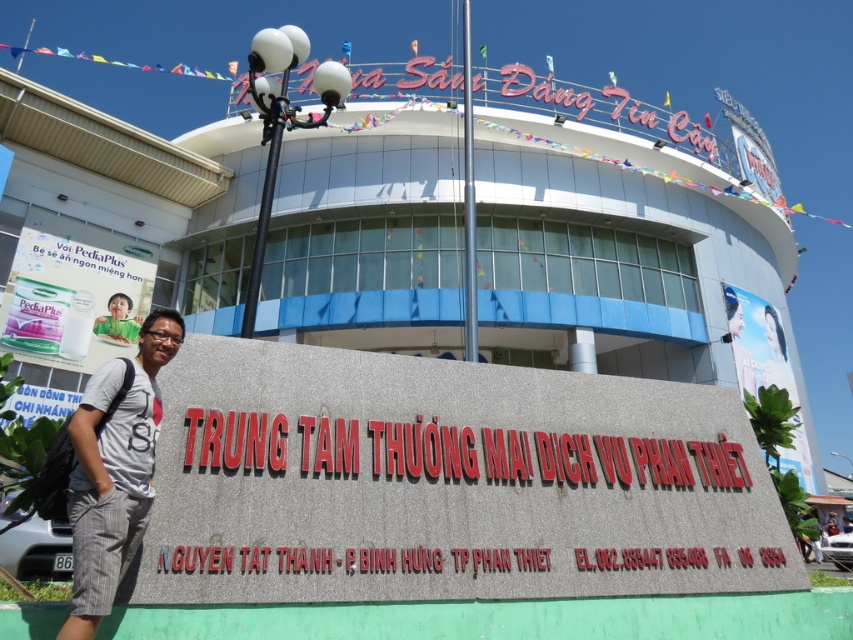
Measure the distance between gray cotton t-shirt at left and white plastic sign at upper left.

They are 14.67 meters apart.

Is point (126, 477) positioned behind point (41, 253)?

No, (126, 477) is in front of (41, 253).

Between point (106, 524) and point (91, 300), which one is positioned behind?

Point (91, 300)

Where is `gray cotton t-shirt at left`? gray cotton t-shirt at left is located at coordinates (114, 472).